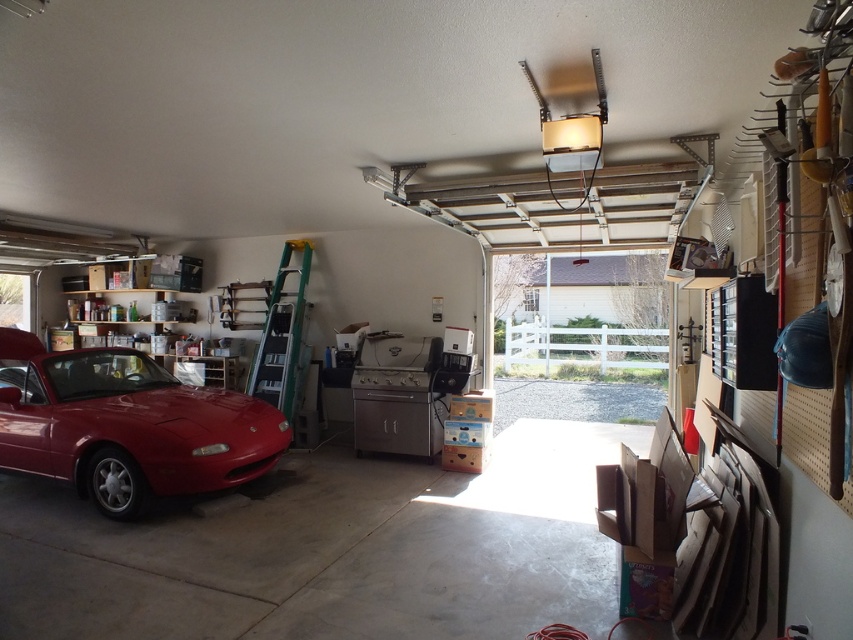
Is point (45, 417) more distant than point (286, 394)?

No, it is in front of (286, 394).

Based on the photo, which is below, glossy red car at left or metallic silver ladder at left?

glossy red car at left is below.

Who is more distant from viewer, (111, 484) or (283, 324)?

The point (283, 324) is more distant.

Locate an element on the screen. glossy red car at left is located at coordinates (126, 426).